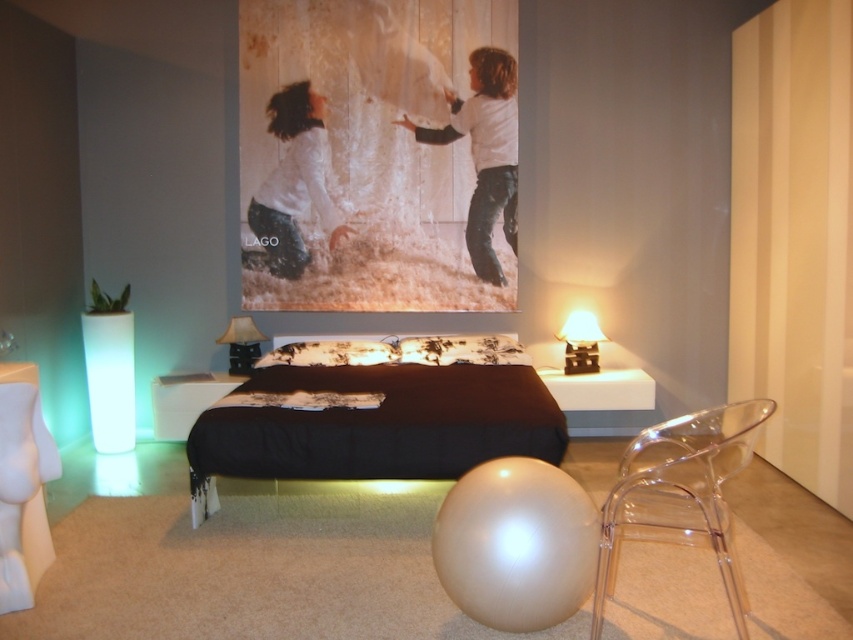
Does transparent acrylic chair at lower right appear over matte black lampshade at upper center?

Incorrect, transparent acrylic chair at lower right is not positioned above matte black lampshade at upper center.

Is transparent acrylic chair at lower right thinner than matte black lampshade at upper center?

In fact, transparent acrylic chair at lower right might be wider than matte black lampshade at upper center.

The height and width of the screenshot is (640, 853). Identify the location of transparent acrylic chair at lower right. (680, 493).

Which is in front, point (431, 348) or point (572, 355)?

Point (431, 348) is in front.

Is white floral fabric pillow at center taller than matte black lampshade at right?

Incorrect, white floral fabric pillow at center's height is not larger of matte black lampshade at right's.

Which is behind, point (488, 360) or point (572, 333)?

The point (572, 333) is behind.

Locate an element on the screen. Image resolution: width=853 pixels, height=640 pixels. white floral fabric pillow at center is located at coordinates (462, 349).

Who is shorter, white textured fabric at upper center or transparent acrylic chair at lower right?

With less height is transparent acrylic chair at lower right.

Can you confirm if white textured fabric at upper center is taller than transparent acrylic chair at lower right?

Yes, white textured fabric at upper center is taller than transparent acrylic chair at lower right.

Which is behind, point (281, 177) or point (738, 428)?

Positioned behind is point (281, 177).

Where is `white textured fabric at upper center`? The image size is (853, 640). white textured fabric at upper center is located at coordinates coord(378,154).